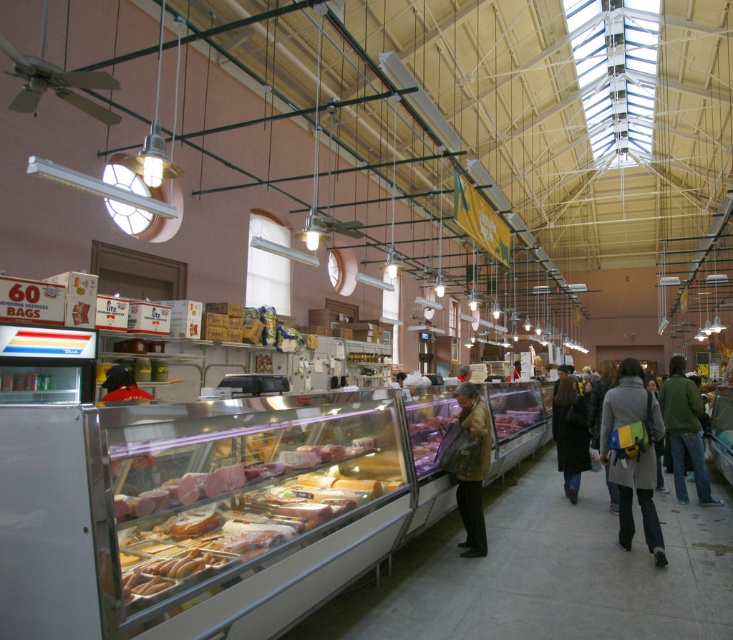
You are trying to decide between two coats displayed at the center of the deli section in the market. The green wool coat at center and the brown leather jacket at center. Which one would be more suitable if you need a warmer option?

The brown leather jacket at center is thicker than the green wool coat at center, so it would provide more warmth.

You are a customer in the deli section and want to grab both the translucent plastic meat at center and the smooth pink meat at center. Which one should you reach for first if you want to take the one on the left first?

You should reach for the translucent plastic meat at center first because it is positioned to the left of the smooth pink meat at center.